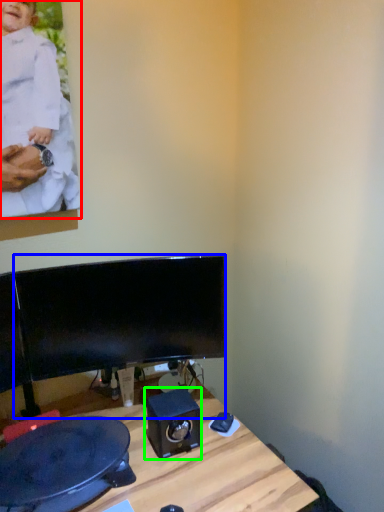
Question: Which object is positioned closest to person (highlighted by a red box)? Select from computer monitor (highlighted by a blue box) and speaker (highlighted by a green box).

Choices:
 (A) computer monitor
 (B) speaker

Answer: (A)